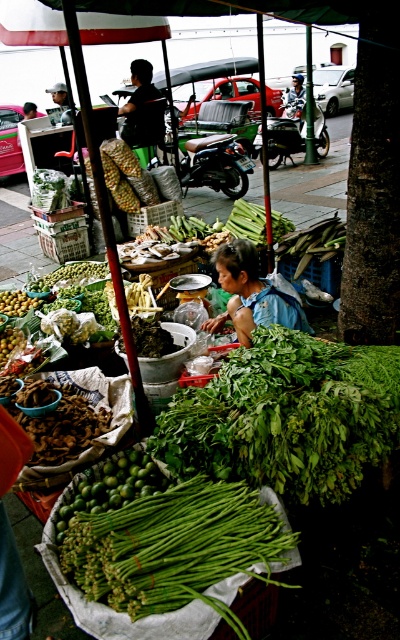
Does point (338, 358) come behind point (127, 568)?

Yes, point (338, 358) is behind point (127, 568).

Is green leafy at center closer to the viewer compared to green matte asparagus at center?

No, green leafy at center is further to the viewer.

Who is more forward, (352, 365) or (67, 570)?

Point (67, 570)

Locate an element on the screen. The image size is (400, 640). green leafy at center is located at coordinates (287, 417).

Based on the photo, who is lower down, green leafy at center or green matte asparagus at lower center?

green matte asparagus at lower center

Does point (318, 364) lie in front of point (118, 467)?

Yes, it is in front of point (118, 467).

What are the coordinates of `green leafy at center` in the screenshot? It's located at (287, 417).

Between point (220, 280) and point (137, 461), which one is positioned behind?

The point (220, 280) is more distant.

Does point (286, 321) come in front of point (113, 502)?

No.

Does point (260, 294) come farther from viewer compared to point (124, 452)?

That is True.

Find the location of a particular element. The height and width of the screenshot is (640, 400). blue denim shirt at center is located at coordinates (250, 294).